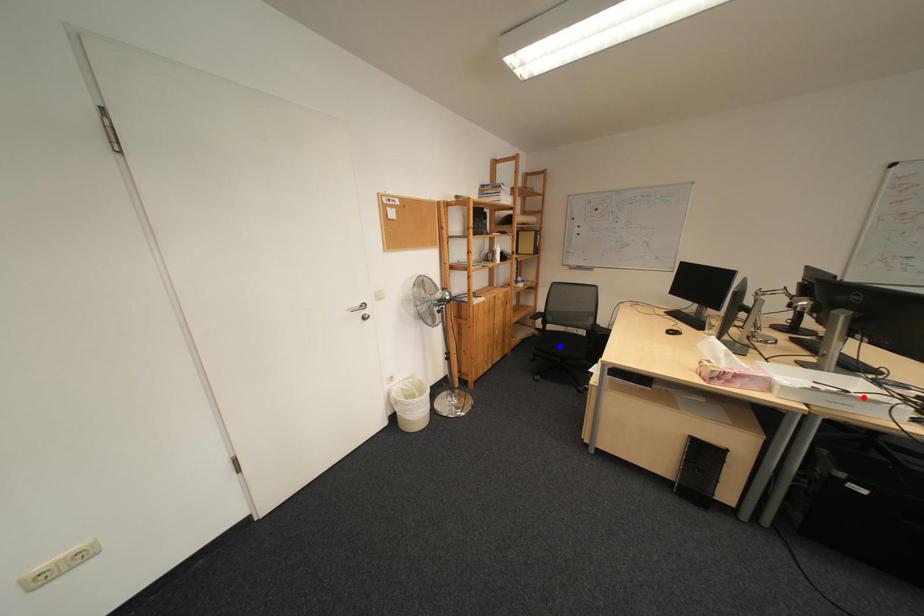
Question: Two points are marked on the image. Which point is closer to the camera?

Choices:
 (A) Blue point is closer.
 (B) Red point is closer.

Answer: (B)